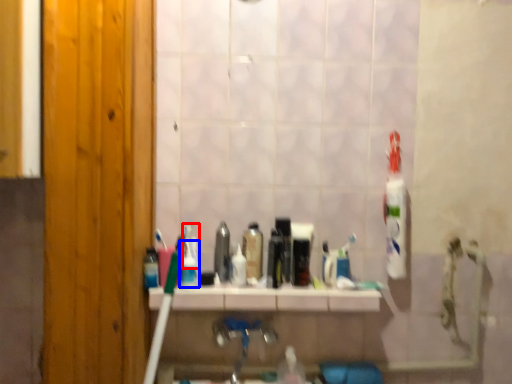
Question: Which object appears closest to the camera in this image, toothpaste (highlighted by a red box) or mouthwash (highlighted by a blue box)?

Choices:
 (A) toothpaste
 (B) mouthwash

Answer: (B)